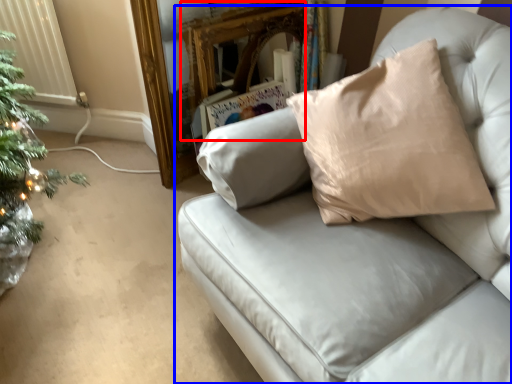
Question: Which object appears farthest to the camera in this image, mirror (highlighted by a red box) or studio couch (highlighted by a blue box)?

Choices:
 (A) mirror
 (B) studio couch

Answer: (A)